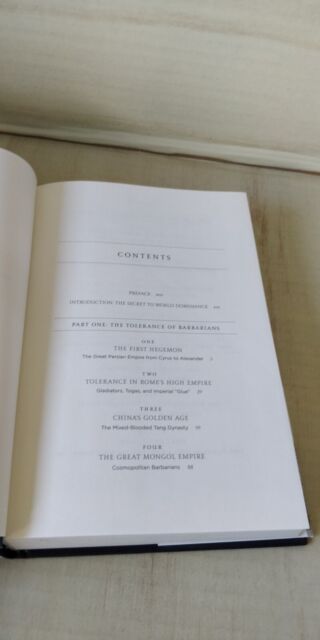
The height and width of the screenshot is (640, 320). I want to click on dust cover, so click(x=310, y=532).